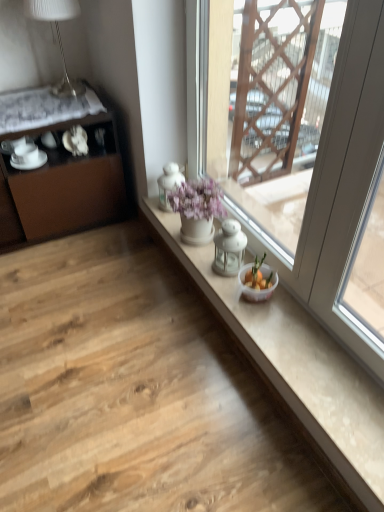
Question: Based on their positions, is white glossy teacup at left, the first tableware positioned from the left, located to the left or right of white porcelain saucer at left, which appears as the 2th tableware when viewed from the left?

Choices:
 (A) left
 (B) right

Answer: (A)

Question: Looking at the image, does white glossy teacup at left, the first tableware positioned from the left, seem bigger or smaller compared to white porcelain saucer at left, the 1th tableware from the right?

Choices:
 (A) small
 (B) big

Answer: (A)

Question: Which of these objects is positioned farthest from the white porcelain saucer at left, which appears as the 2th tableware when viewed from the left?

Choices:
 (A) white glossy counter top at center
 (B) white glass window at center
 (C) white glossy teacup at left, arranged as the 2th tableware when viewed from the right
 (D) brown matte cabinet at left
 (E) white glossy table lamp at upper left

Answer: (A)

Question: Which object is positioned closest to the brown matte cabinet at left?

Choices:
 (A) white porcelain saucer at left, which appears as the 2th tableware when viewed from the left
 (B) white glossy table lamp at upper left
 (C) white glossy teacup at left, arranged as the 2th tableware when viewed from the right
 (D) white glass window at center
 (E) white glossy counter top at center

Answer: (A)